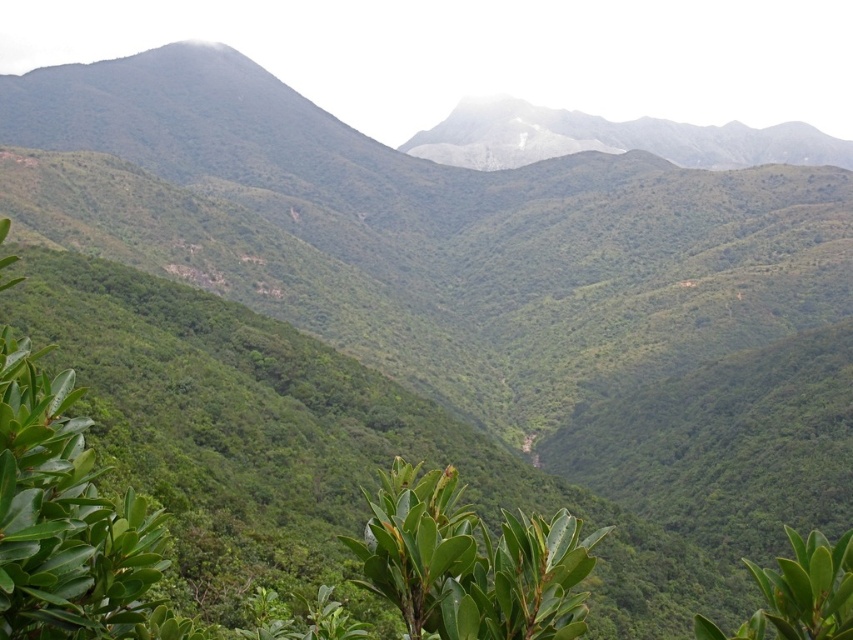
You are standing in the valley and want to determine which of the two points, point [483,541] or point [491,100], is nearer to you. Based on the scene, which point is closer?

Point [483,541] is closer to the viewer than point [491,100].

You are an environmental scientist studying the valley. You observe the green leafy shrub at left and the green leafy plant at center. Which one has a larger size?

The green leafy plant at center is larger than the green leafy shrub at left.

You are standing in the lush valley and want to locate the green leafy plant at center. According to the coordinates provided, where exactly should you look to find it?

The green leafy plant at center is located at point coordinates of 0.880 on the x axis and 0.552 on the y axis.